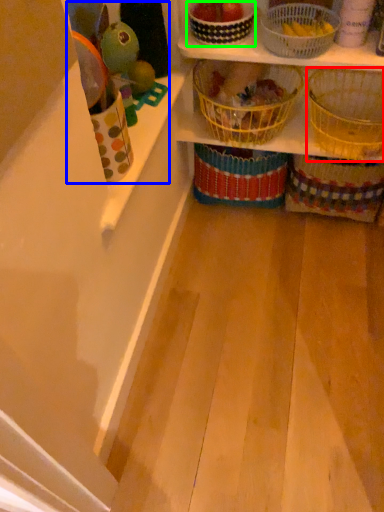
Question: Which object is positioned farthest from basket (highlighted by a red box)? Select from toy (highlighted by a blue box) and basket (highlighted by a green box).

Choices:
 (A) toy
 (B) basket

Answer: (A)